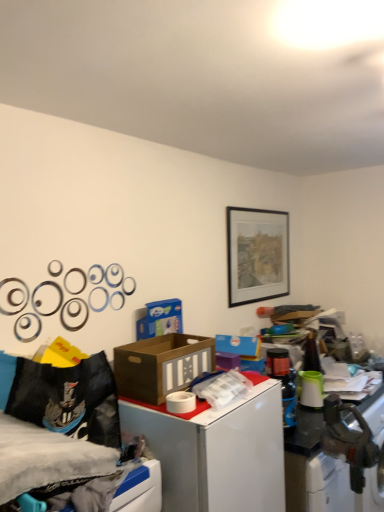
I want to click on black fabric bed at lower left, so click(69, 441).

Image resolution: width=384 pixels, height=512 pixels. What do you see at coordinates (161, 365) in the screenshot?
I see `brown cardboard box at center` at bounding box center [161, 365].

Image resolution: width=384 pixels, height=512 pixels. Identify the location of black matte picture frame at upper center. (257, 255).

Image resolution: width=384 pixels, height=512 pixels. Identify the location of white cardboard box at upper right. (217, 451).

Can you confirm if white cardboard box at upper right is taller than metallic silver washing machine at lower right?

Correct, white cardboard box at upper right is much taller as metallic silver washing machine at lower right.

Considering the points (121, 419) and (377, 459), which point is behind, point (121, 419) or point (377, 459)?

Positioned behind is point (377, 459).

Is white cardboard box at upper right not inside metallic silver washing machine at lower right?

Yes, white cardboard box at upper right is located beyond the bounds of metallic silver washing machine at lower right.

From the image's perspective, is black fabric bed at lower left on metallic silver washing machine at lower right?

Yes, from the image's perspective, black fabric bed at lower left is on top of metallic silver washing machine at lower right.

Between point (15, 441) and point (350, 441), which one is positioned behind?

The point (350, 441) is behind.

Between black fabric bed at lower left and metallic silver washing machine at lower right, which one appears on the left side from the viewer's perspective?

Positioned to the left is black fabric bed at lower left.

From the picture: From a real-world perspective, which object rests below the other?

metallic silver washing machine at lower right is physically lower.

Would you say black matte picture frame at upper center is outside white cardboard box at upper right?

That's correct, black matte picture frame at upper center is outside of white cardboard box at upper right.

Could you tell me if black matte picture frame at upper center is facing white cardboard box at upper right?

No, black matte picture frame at upper center is not aimed at white cardboard box at upper right.

Considering the relative sizes of black matte picture frame at upper center and white cardboard box at upper right in the image provided, is black matte picture frame at upper center smaller than white cardboard box at upper right?

Indeed, black matte picture frame at upper center has a smaller size compared to white cardboard box at upper right.

Based on their positions, is black matte picture frame at upper center located to the left or right of white cardboard box at upper right?

black matte picture frame at upper center is to the right of white cardboard box at upper right.

Relative to white cardboard box at upper right, is metallic silver washing machine at lower right in front or behind?

metallic silver washing machine at lower right is positioned farther from the viewer than white cardboard box at upper right.

From the image's perspective, is metallic silver washing machine at lower right positioned above or below white cardboard box at upper right?

metallic silver washing machine at lower right is below white cardboard box at upper right.

What's the angular difference between metallic silver washing machine at lower right and white cardboard box at upper right's facing directions?

4.96 degrees.

What's the angular difference between metallic silver washing machine at lower right and black fabric bed at lower left's facing directions?

The angle between the facing direction of metallic silver washing machine at lower right and the facing direction of black fabric bed at lower left is 2.42 degrees.

Is metallic silver washing machine at lower right shorter than black fabric bed at lower left?

No.

Does metallic silver washing machine at lower right turn towards black fabric bed at lower left?

No, metallic silver washing machine at lower right is not aimed at black fabric bed at lower left.

Is point (163, 397) closer or farther from the camera than point (218, 470)?

Point (163, 397) is farther from the camera than point (218, 470).

Locate an element on the screen. box that appears above the white cardboard box at upper right (from the image's perspective) is located at coordinates (161, 365).

Can you see brown cardboard box at center touching white cardboard box at upper right?

No, brown cardboard box at center is not with white cardboard box at upper right.

From a real-world perspective, is brown cardboard box at center physically located above or below metallic silver washing machine at lower right?

In terms of real-world spatial position, brown cardboard box at center is above metallic silver washing machine at lower right.

In terms of size, does brown cardboard box at center appear bigger or smaller than metallic silver washing machine at lower right?

brown cardboard box at center is smaller than metallic silver washing machine at lower right.

Are brown cardboard box at center and metallic silver washing machine at lower right located far from each other?

No, brown cardboard box at center is not far from metallic silver washing machine at lower right.

Considering the relative sizes of brown cardboard box at center and metallic silver washing machine at lower right in the image provided, is brown cardboard box at center wider than metallic silver washing machine at lower right?

Incorrect, the width of brown cardboard box at center does not surpass that of metallic silver washing machine at lower right.

Where is `table on the left of metallic silver washing machine at lower right`? The width and height of the screenshot is (384, 512). table on the left of metallic silver washing machine at lower right is located at coordinates (217, 451).

This screenshot has width=384, height=512. What are the coordinates of `bed in front of the metallic silver washing machine at lower right` in the screenshot? It's located at (69, 441).

From the image, which object appears to be nearer to metallic silver washing machine at lower right, black fabric bed at lower left or brown cardboard box at center?

brown cardboard box at center lies closer to metallic silver washing machine at lower right than the other object.

Considering their positions, is brown cardboard box at center positioned further to black matte picture frame at upper center than metallic silver washing machine at lower right?

metallic silver washing machine at lower right is further to black matte picture frame at upper center.

Looking at the image, which one is located further to metallic silver washing machine at lower right, white cardboard box at upper right or black fabric bed at lower left?

black fabric bed at lower left.

Based on their spatial positions, is white cardboard box at upper right or brown cardboard box at center closer to black fabric bed at lower left?

white cardboard box at upper right is closer to black fabric bed at lower left.

Based on the photo, from the image, which object appears to be nearer to white cardboard box at upper right, brown cardboard box at center or black fabric bed at lower left?

brown cardboard box at center is positioned closer to the anchor white cardboard box at upper right.

Estimate the real-world distances between objects in this image. Which object is further from brown cardboard box at center, black matte picture frame at upper center or black fabric bed at lower left?

black matte picture frame at upper center.

Based on their spatial positions, is metallic silver washing machine at lower right or black fabric bed at lower left closer to black matte picture frame at upper center?

metallic silver washing machine at lower right.

Considering their positions, is black matte picture frame at upper center positioned closer to metallic silver washing machine at lower right than black fabric bed at lower left?

black matte picture frame at upper center is closer to metallic silver washing machine at lower right.

This screenshot has width=384, height=512. Identify the location of table positioned between black fabric bed at lower left and black matte picture frame at upper center from near to far. (217, 451).

You are a GUI agent. You are given a task and a screenshot of the screen. Output one action in this format:
    pyautogui.click(x=<x>, y=<y>)
    Task: Click on the box located between black fabric bed at lower left and black matte picture frame at upper center in the depth direction
    The width and height of the screenshot is (384, 512).
    Given the screenshot: What is the action you would take?
    pyautogui.click(x=161, y=365)

Identify the location of box between white cardboard box at upper right and black matte picture frame at upper center in the front-back direction. Image resolution: width=384 pixels, height=512 pixels. (161, 365).

Locate an element on the screen. washing machine between black fabric bed at lower left and black matte picture frame at upper center from front to back is located at coordinates (352, 445).